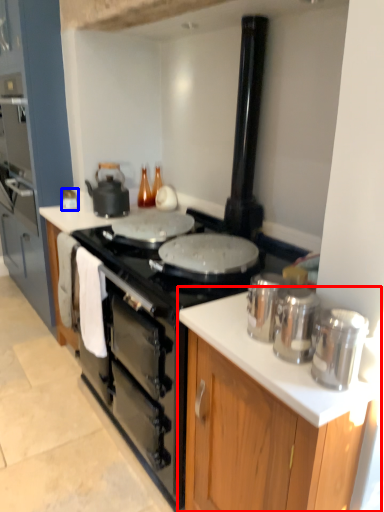
Question: Which point is closer to the camera, cabinetry (highlighted by a red box) or kitchen appliance (highlighted by a blue box)?

Choices:
 (A) cabinetry
 (B) kitchen appliance

Answer: (A)